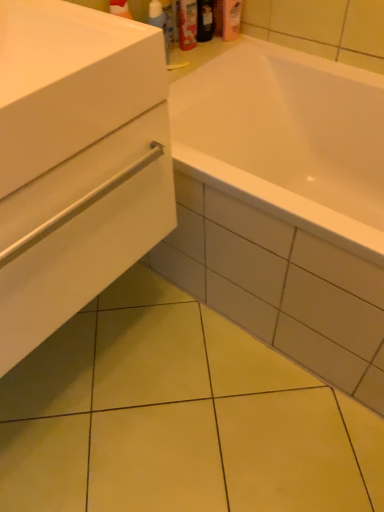
Question: Is the surface of white matte drawer at lower left in direct contact with white glossy sink at left?

Choices:
 (A) yes
 (B) no

Answer: (B)

Question: Considering the relative positions of white matte drawer at lower left and white glossy sink at left in the image provided, is white matte drawer at lower left behind white glossy sink at left?

Choices:
 (A) yes
 (B) no

Answer: (A)

Question: Does white matte drawer at lower left have a smaller size compared to white glossy sink at left?

Choices:
 (A) yes
 (B) no

Answer: (B)

Question: From a real-world perspective, does white matte drawer at lower left sit lower than white glossy sink at left?

Choices:
 (A) no
 (B) yes

Answer: (B)

Question: Does white matte drawer at lower left have a greater width compared to white glossy sink at left?

Choices:
 (A) no
 (B) yes

Answer: (A)

Question: From a real-world perspective, relative to translucent plastic spray bottle at upper center, is white matte drawer at lower left vertically above or below?

Choices:
 (A) below
 (B) above

Answer: (A)

Question: Considering the positions of white matte drawer at lower left and translucent plastic spray bottle at upper center in the image, is white matte drawer at lower left wider or thinner than translucent plastic spray bottle at upper center?

Choices:
 (A) wide
 (B) thin

Answer: (A)

Question: Does point (160, 196) appear closer or farther from the camera than point (150, 16)?

Choices:
 (A) farther
 (B) closer

Answer: (B)

Question: Is white matte drawer at lower left inside the boundaries of translucent plastic spray bottle at upper center, or outside?

Choices:
 (A) inside
 (B) outside

Answer: (B)

Question: Is translucent plastic spray bottle at upper center taller or shorter than white glossy sink at left?

Choices:
 (A) short
 (B) tall

Answer: (B)

Question: Is translucent plastic spray bottle at upper center to the left or to the right of white glossy sink at left in the image?

Choices:
 (A) right
 (B) left

Answer: (A)

Question: Is point (155, 17) closer or farther from the camera than point (48, 87)?

Choices:
 (A) farther
 (B) closer

Answer: (A)

Question: From a real-world perspective, is translucent plastic spray bottle at upper center positioned above or below white glossy sink at left?

Choices:
 (A) above
 (B) below

Answer: (B)

Question: Is translucent plastic spray bottle at upper center wider or thinner than pink matte lotion at upper center, placed as the third toiletry when sorted from left to right?

Choices:
 (A) thin
 (B) wide

Answer: (A)

Question: From the image's perspective, is translucent plastic spray bottle at upper center above or below pink matte lotion at upper center, marked as the 1th toiletry in a right-to-left arrangement?

Choices:
 (A) above
 (B) below

Answer: (B)